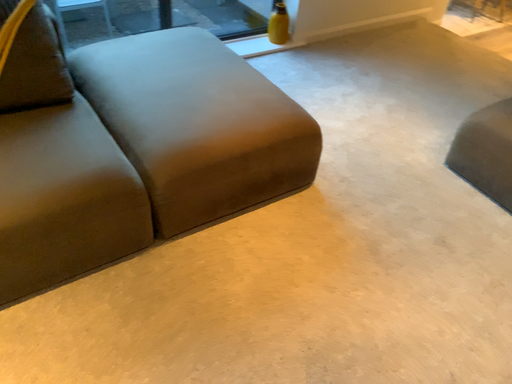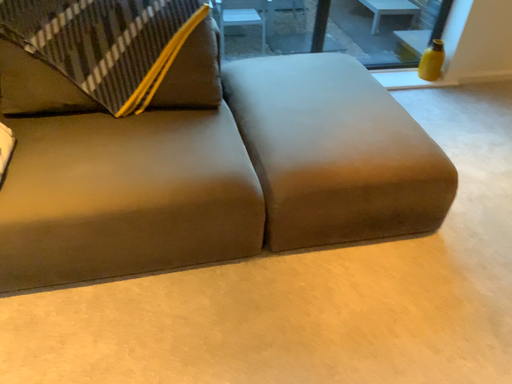
Question: Which way did the camera rotate in the video?

Choices:
 (A) rotated left
 (B) rotated right

Answer: (A)